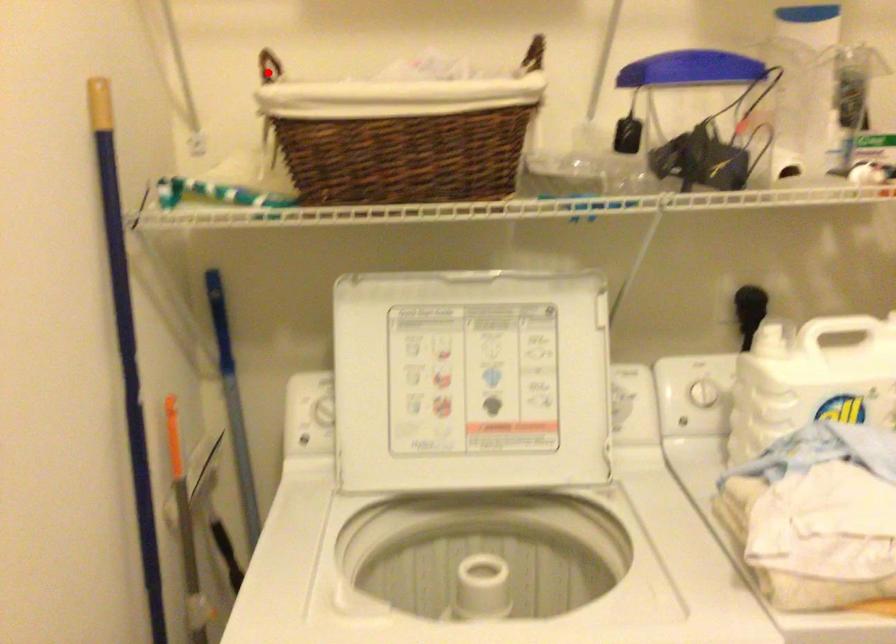
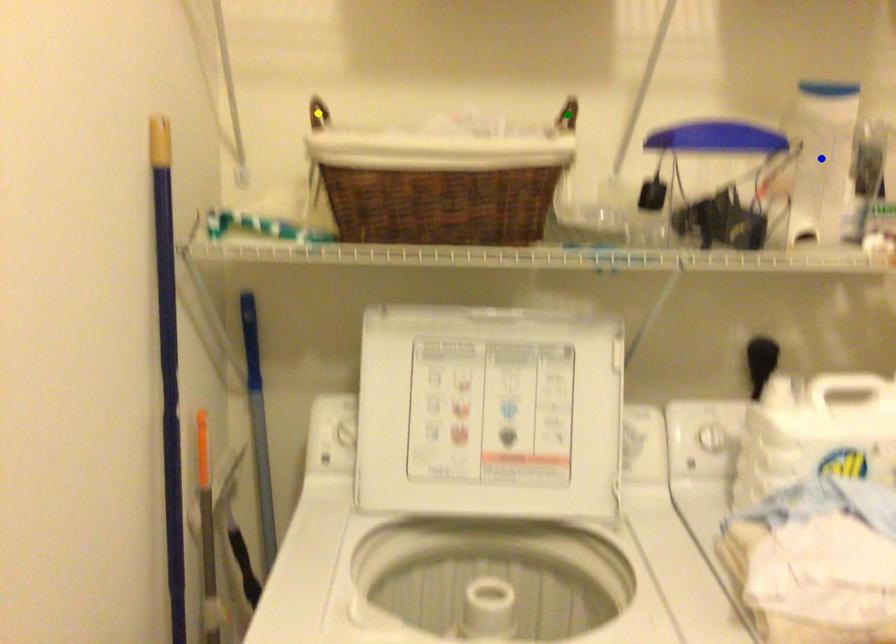
Question: I am providing you with two images of the same scene from different viewpoints. A red point is marked on the first image. You are given multiple points on the second image. In image 2, which mark is for the same physical point as the one in image 1?

Choices:
 (A) blue point
 (B) green point
 (C) yellow point

Answer: (C)